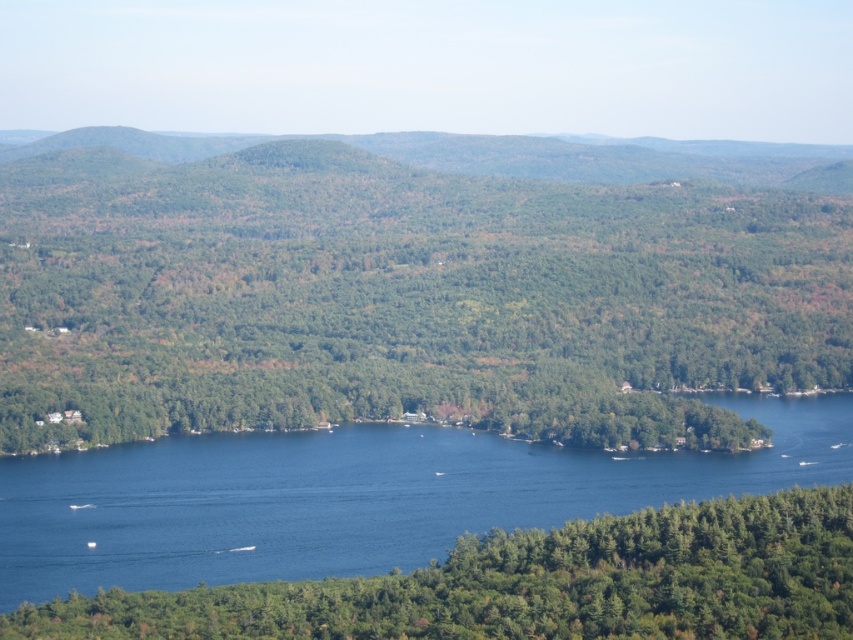
You are planning to set up a picnic area in this serene landscape. You have two options for locations near the green matte tree at center and the green matte tree at lower center. Considering their sizes, which tree would provide more shade for your picnic setup?

The green matte tree at center is larger in size than the green matte tree at lower center, so it would provide more shade for the picnic setup.